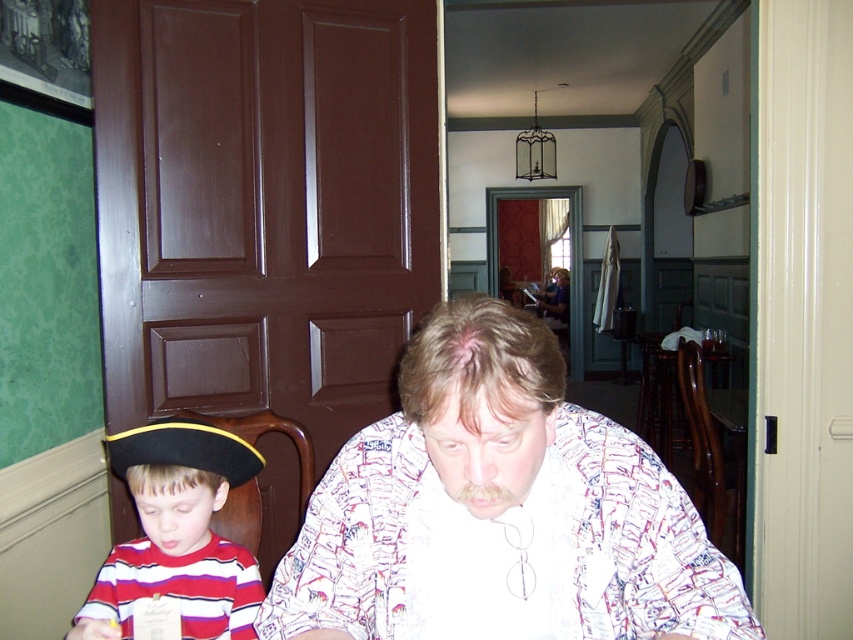
Between white printed shirt at center and striped cotton shirt at lower left, which one has more height?

white printed shirt at center is taller.

Is white printed shirt at center to the right of striped cotton shirt at lower left from the viewer's perspective?

Indeed, white printed shirt at center is positioned on the right side of striped cotton shirt at lower left.

Which is in front, point (485, 400) or point (143, 563)?

Positioned in front is point (485, 400).

Where is `white printed shirt at center`? Image resolution: width=853 pixels, height=640 pixels. white printed shirt at center is located at coordinates (502, 497).